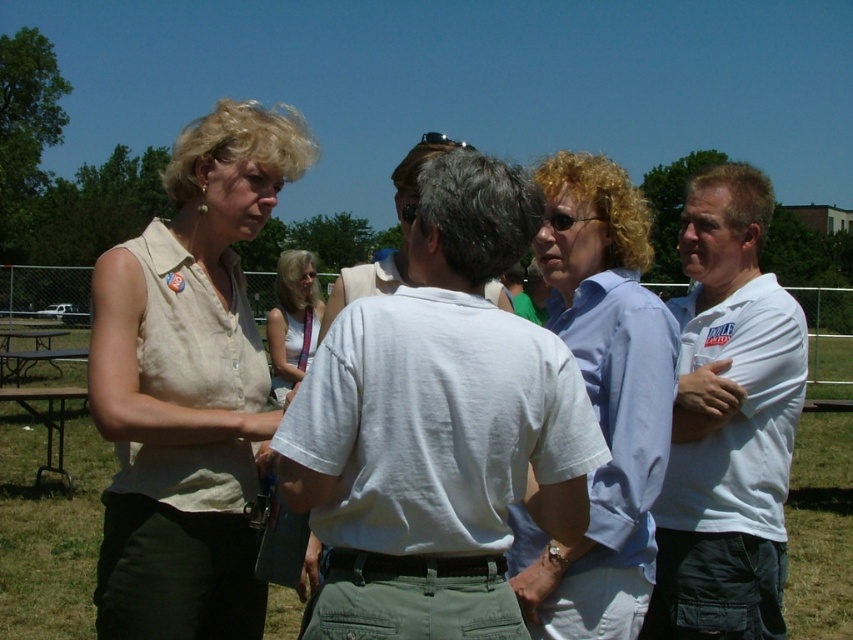
You are a photographer trying to capture a group photo of the people in the scene. You notice the white cotton shirt at center and the matte beige blouse at left. Which clothing item would appear narrower in the photo?

The white cotton shirt at center is thinner than the matte beige blouse at left, so it would appear narrower in the photo.